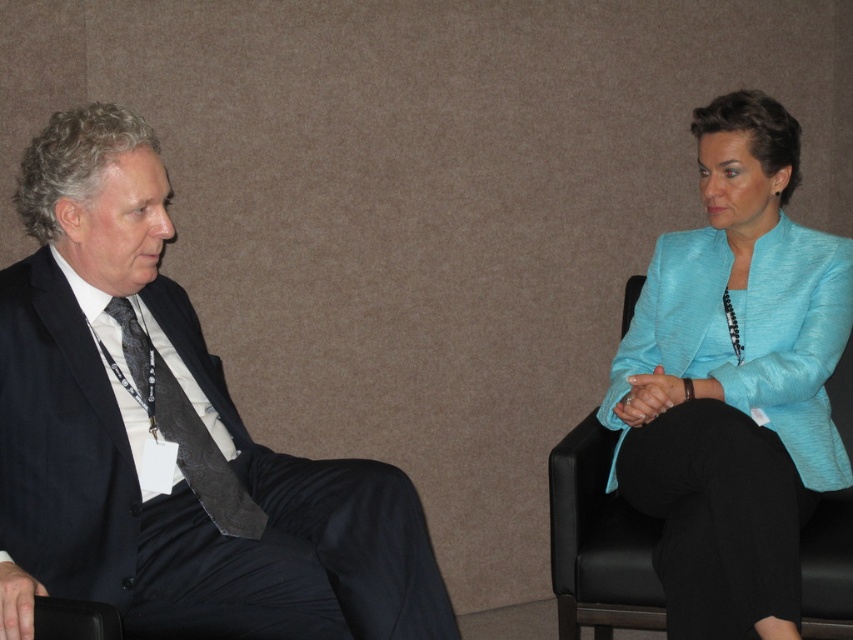
You are an event organizer who needs to ensure that all attendees are properly identified. You notice the dark blue suit at left and the dark gray textured tie at left. Which item is closer to the camera, and therefore more visible for scanning the badge?

The dark blue suit at left is in front of the dark gray textured tie at left, so the dark blue suit at left is closer to the camera and more visible for scanning the badge.

You are a photographer setting up for a group photo. You need to ensure that the distance between the turquoise fabric jacket at right and the dark gray textured tie at left is at least 40 inches to avoid overlapping in the frame. Based on the scene description, will this distance requirement be met?

A: The turquoise fabric jacket at right is 38.52 inches from the dark gray textured tie at left, which is less than the required 40 inches. Therefore, the distance requirement will not be met, and adjustments may be needed to prevent overlapping in the photo.